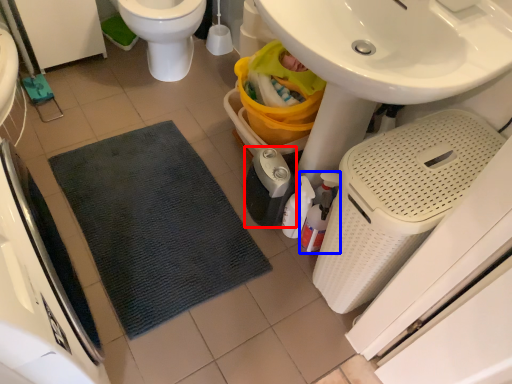
Question: Among these objects, which one is farthest to the camera, appliance (highlighted by a red box) or cleaning product (highlighted by a blue box)?

Choices:
 (A) appliance
 (B) cleaning product

Answer: (A)